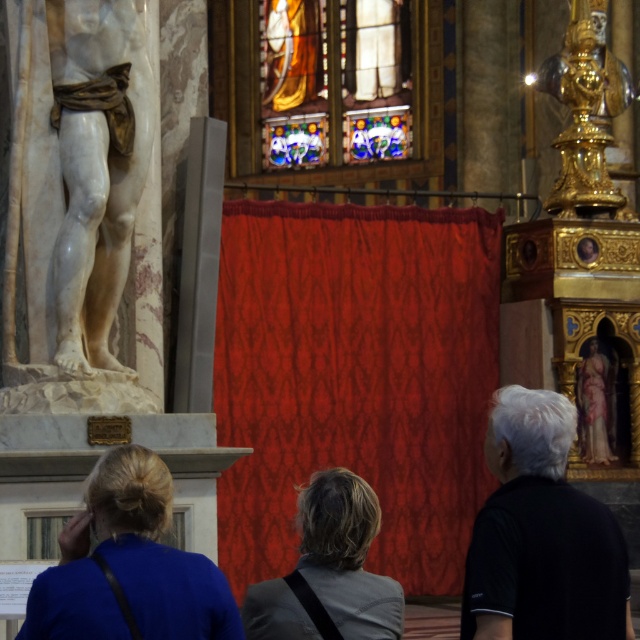
Is white marble statue at left to the right of blue fabric at lower left from the viewer's perspective?

Incorrect, white marble statue at left is not on the right side of blue fabric at lower left.

Does white marble statue at left have a smaller size compared to blue fabric at lower left?

Yes, white marble statue at left is smaller than blue fabric at lower left.

Is point (48, 320) in front of point (147, 529)?

No, (48, 320) is further to viewer.

At what (x,y) coordinates should I click in order to perform the action: click on white marble statue at left. Please return your answer as a coordinate pair (x, y). The image size is (640, 640). Looking at the image, I should click on (81, 202).

Who is more forward, (529, 429) or (344, 573)?

Positioned in front is point (344, 573).

Does black fabric at lower right lie behind gray fabric jacket at center?

Yes, black fabric at lower right is further from the viewer.

This screenshot has height=640, width=640. What do you see at coordinates (541, 534) in the screenshot? I see `black fabric at lower right` at bounding box center [541, 534].

Where is `black fabric at lower right`? black fabric at lower right is located at coordinates (541, 534).

How far apart are stained glass window at upper center and gold/gilded statue at upper right?

stained glass window at upper center is 22.81 meters from gold/gilded statue at upper right.

Can you confirm if stained glass window at upper center is positioned below gold/gilded statue at upper right?

Actually, stained glass window at upper center is above gold/gilded statue at upper right.

Is point (308, 145) farther from camera compared to point (570, 145)?

Yes, it is behind point (570, 145).

The height and width of the screenshot is (640, 640). Find the location of `stained glass window at upper center`. stained glass window at upper center is located at coordinates [x=333, y=81].